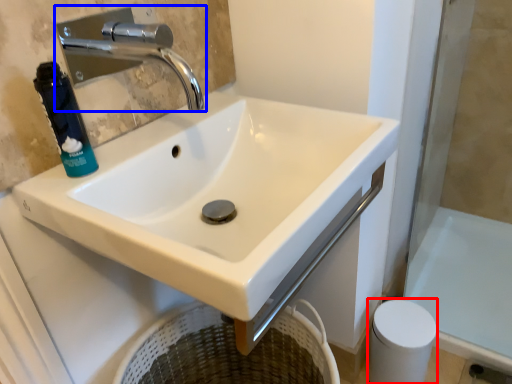
Question: Which object appears farthest to the camera in this image, toilet paper (highlighted by a red box) or tap (highlighted by a blue box)?

Choices:
 (A) toilet paper
 (B) tap

Answer: (A)